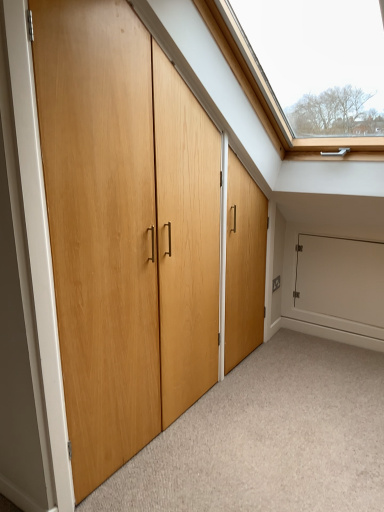
The height and width of the screenshot is (512, 384). What are the coordinates of `vacant space to the right of natural wood door at center` in the screenshot? It's located at (288, 399).